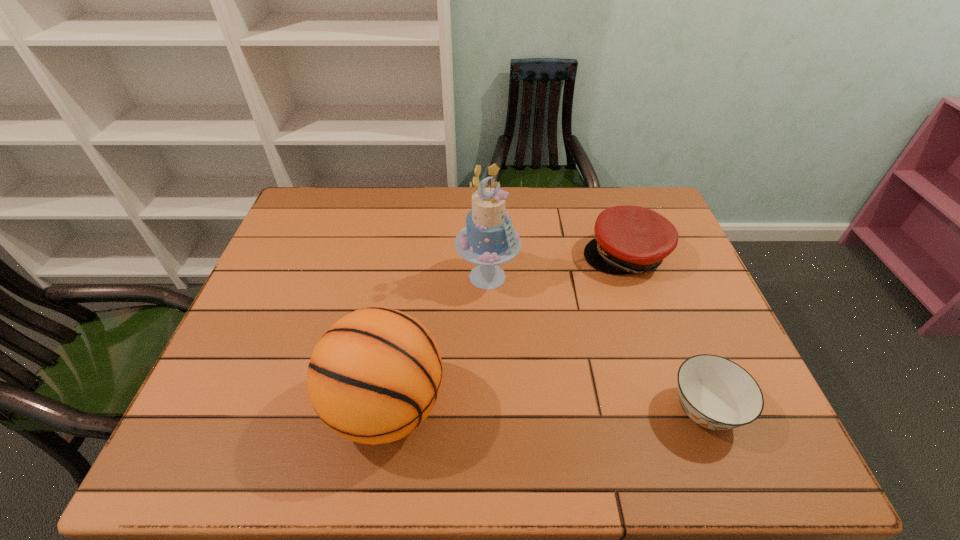
At what (x,y) coordinates should I click in order to perform the action: click on free space between the leftmost object and the tallest object. Please return your answer as a coordinate pair (x, y). The height and width of the screenshot is (540, 960). Looking at the image, I should click on (437, 342).

This screenshot has height=540, width=960. Find the location of `vacant area that lies between the basketball and the soup bowl`. vacant area that lies between the basketball and the soup bowl is located at coordinates (545, 409).

The height and width of the screenshot is (540, 960). What are the coordinates of `empty space between the tallest object and the soup bowl` in the screenshot? It's located at (596, 343).

You are a GUI agent. You are given a task and a screenshot of the screen. Output one action in this format:
    pyautogui.click(x=<x>, y=<y>)
    Task: Click on the second closest object relative to the third object from right to left
    This screenshot has width=960, height=540.
    Given the screenshot: What is the action you would take?
    point(628,239)

Find the location of `object that stands as the third closest to the cap`. object that stands as the third closest to the cap is located at coordinates [374, 376].

You are a GUI agent. You are given a task and a screenshot of the screen. Output one action in this format:
    pyautogui.click(x=<x>, y=<y>)
    Task: Click on the free spot that satisfies the following two spatial constraints: 1. on the front side of the second shortest object; 2. on the left side of the soup bowl
    
    Given the screenshot: What is the action you would take?
    pyautogui.click(x=679, y=410)